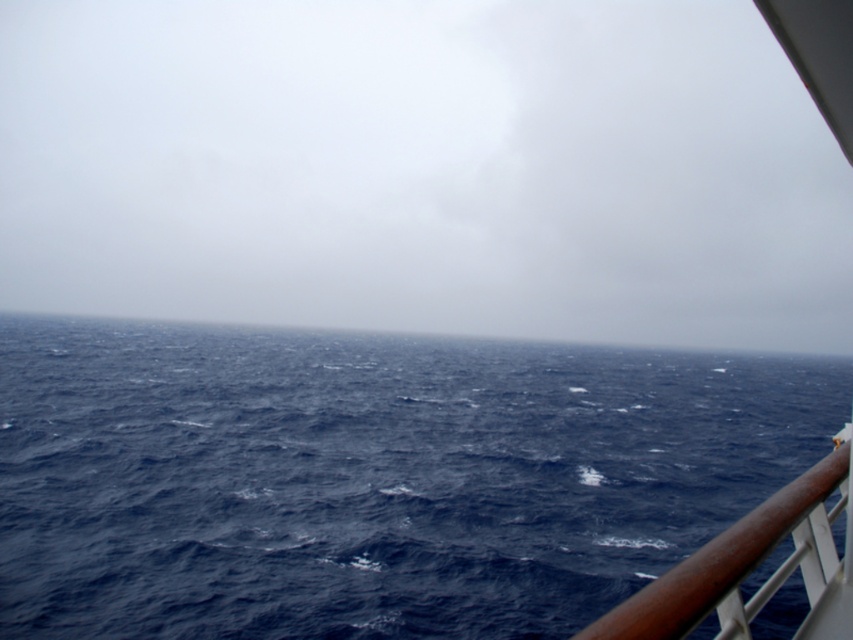
Question: Which object appears farthest from the camera in this image?

Choices:
 (A) brown polished wood at right
 (B) blue water at center

Answer: (B)

Question: Which object is farther from the camera taking this photo?

Choices:
 (A) blue water at center
 (B) dark blue water at center

Answer: (A)

Question: Can you confirm if dark blue water at center is positioned above brown polished wood at right?

Choices:
 (A) no
 (B) yes

Answer: (A)

Question: Among these objects, which one is nearest to the camera?

Choices:
 (A) brown polished wood at right
 (B) blue water at center
 (C) dark blue water at center

Answer: (A)

Question: Is dark blue water at center wider than brown polished wood at right?

Choices:
 (A) no
 (B) yes

Answer: (B)

Question: Can you confirm if dark blue water at center is thinner than blue water at center?

Choices:
 (A) yes
 (B) no

Answer: (A)